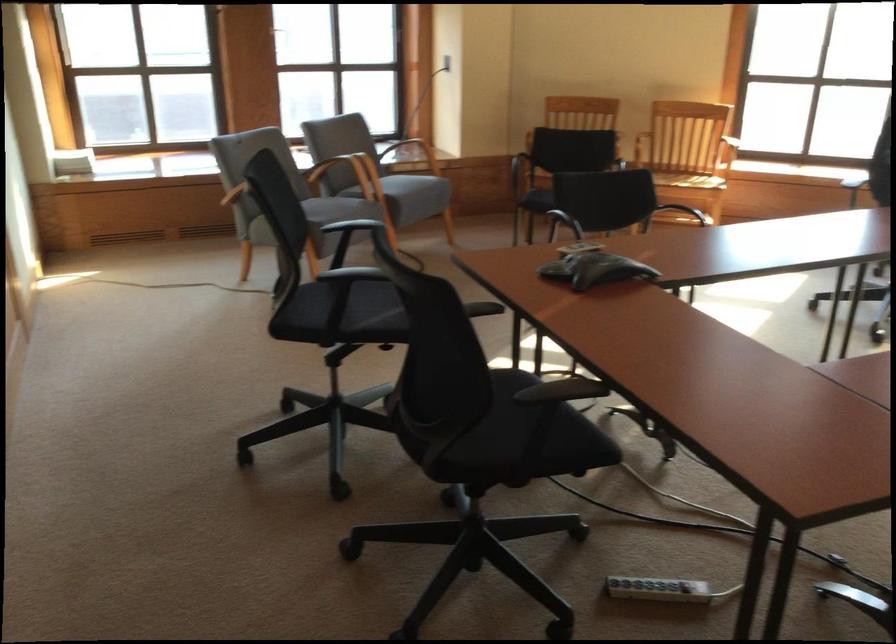
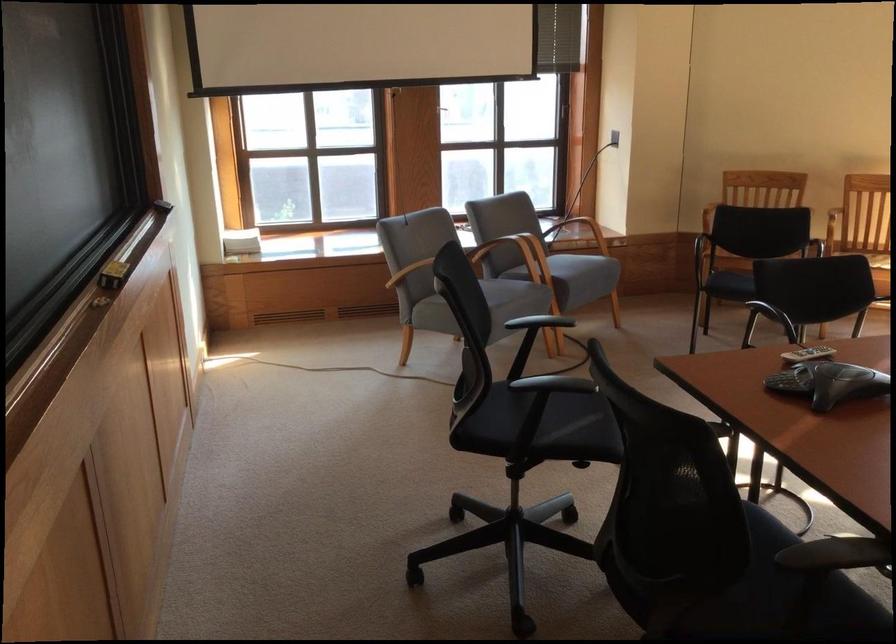
Which direction would the cameraman need to move to produce the second image?

The cameraman walked toward left, forward.